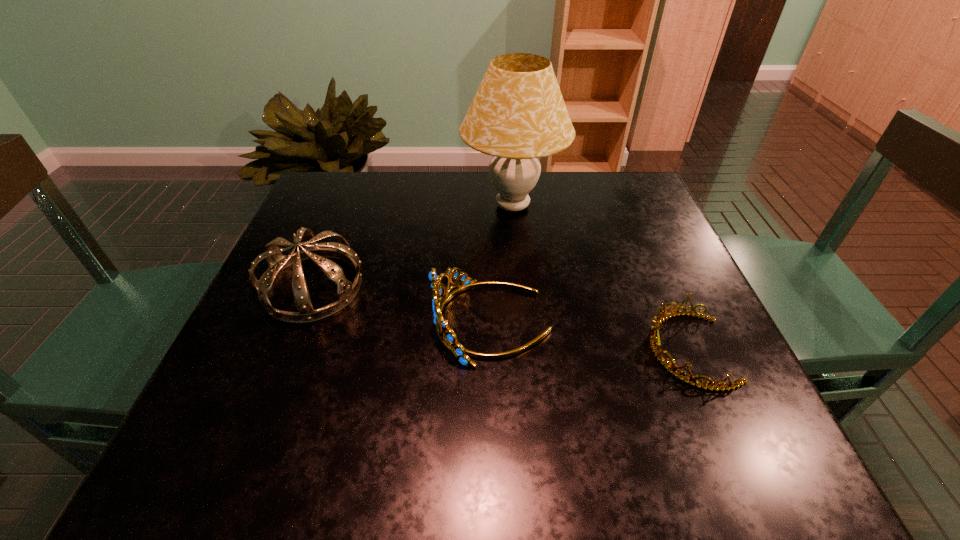
The width and height of the screenshot is (960, 540). In the image, there is a desktop. Identify the location of vacant space at the far left corner. (373, 175).

Locate an element on the screen. This screenshot has width=960, height=540. vacant space at the near left corner is located at coordinates (262, 443).

In the image, there is a desktop. At what (x,y) coordinates should I click in order to perform the action: click on blank space at the far right corner. Please return your answer as a coordinate pair (x, y). This screenshot has width=960, height=540. Looking at the image, I should click on (634, 179).

At what (x,y) coordinates should I click in order to perform the action: click on vacant area between the second tiara from right to left and the lampshade. Please return your answer as a coordinate pair (x, y). This screenshot has width=960, height=540. Looking at the image, I should click on (502, 264).

Image resolution: width=960 pixels, height=540 pixels. In order to click on vacant space that's between the farthest object and the rightmost object in this screenshot , I will do `click(600, 278)`.

The height and width of the screenshot is (540, 960). I want to click on free space between the second tiara from right to left and the shortest object, so coord(590,336).

I want to click on vacant space that is in between the shortest tiara and the second tiara from right to left, so click(590, 336).

Locate an element on the screen. empty space that is in between the second tiara from left to right and the farthest object is located at coordinates (502, 264).

Find the location of a particular element. empty location between the second tiara from right to left and the leftmost tiara is located at coordinates (402, 305).

Find the location of a particular element. This screenshot has height=540, width=960. unoccupied area between the second tiara from left to right and the farthest object is located at coordinates (502, 264).